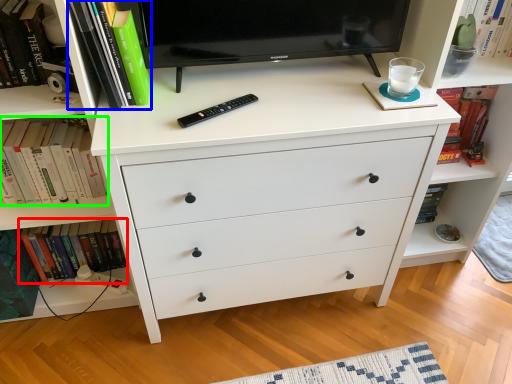
Question: Which object is the closest to the book (highlighted by a red box)? Choose among these: book (highlighted by a blue box) or book (highlighted by a green box).

Choices:
 (A) book
 (B) book

Answer: (B)